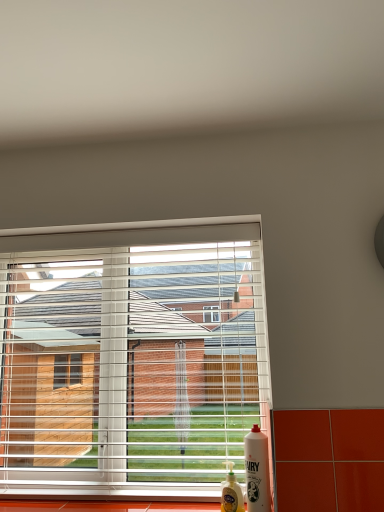
Question: Is white glossy fairy liquid at lower right, acting as the 1th bottle starting from the right, outside of translucent plastic bottle at lower right, the first bottle from the left?

Choices:
 (A) no
 (B) yes

Answer: (B)

Question: From a real-world perspective, does white glossy fairy liquid at lower right, acting as the 1th bottle starting from the right, stand above translucent plastic bottle at lower right, the first bottle from the left?

Choices:
 (A) no
 (B) yes

Answer: (B)

Question: Considering the relative positions of white glossy fairy liquid at lower right, acting as the 1th bottle starting from the right, and translucent plastic bottle at lower right, the first bottle from the left, in the image provided, is white glossy fairy liquid at lower right, acting as the 1th bottle starting from the right, to the left of translucent plastic bottle at lower right, the first bottle from the left, from the viewer's perspective?

Choices:
 (A) yes
 (B) no

Answer: (B)

Question: Does white glossy fairy liquid at lower right, the second bottle viewed from the left, lie behind translucent plastic bottle at lower right, the first bottle from the left?

Choices:
 (A) no
 (B) yes

Answer: (A)

Question: Is white glossy fairy liquid at lower right, the second bottle viewed from the left, looking in the opposite direction of translucent plastic bottle at lower right, the first bottle from the left?

Choices:
 (A) no
 (B) yes

Answer: (A)

Question: Can you confirm if white glossy fairy liquid at lower right, the second bottle viewed from the left, is smaller than translucent plastic bottle at lower right, the first bottle from the left?

Choices:
 (A) no
 (B) yes

Answer: (A)

Question: Considering the relative sizes of translucent plastic bottle at lower right, which is the second bottle from right to left, and white glossy fairy liquid at lower right, the second bottle viewed from the left, in the image provided, is translucent plastic bottle at lower right, which is the second bottle from right to left, shorter than white glossy fairy liquid at lower right, the second bottle viewed from the left,?

Choices:
 (A) no
 (B) yes

Answer: (B)

Question: Is translucent plastic bottle at lower right, the first bottle from the left, not inside white glossy fairy liquid at lower right, acting as the 1th bottle starting from the right?

Choices:
 (A) no
 (B) yes

Answer: (B)

Question: From the image's perspective, is translucent plastic bottle at lower right, which is the second bottle from right to left, located above white glossy fairy liquid at lower right, the second bottle viewed from the left?

Choices:
 (A) no
 (B) yes

Answer: (A)

Question: Is translucent plastic bottle at lower right, the first bottle from the left, turned away from white glossy fairy liquid at lower right, the second bottle viewed from the left?

Choices:
 (A) no
 (B) yes

Answer: (A)

Question: Does translucent plastic bottle at lower right, which is the second bottle from right to left, have a greater width compared to white glossy fairy liquid at lower right, the second bottle viewed from the left?

Choices:
 (A) yes
 (B) no

Answer: (B)

Question: Is translucent plastic bottle at lower right, which is the second bottle from right to left, in contact with white glossy fairy liquid at lower right, acting as the 1th bottle starting from the right?

Choices:
 (A) yes
 (B) no

Answer: (A)

Question: Can you confirm if white glossy fairy liquid at lower right, acting as the 1th bottle starting from the right, is wider than white plastic blinds at center?

Choices:
 (A) no
 (B) yes

Answer: (A)